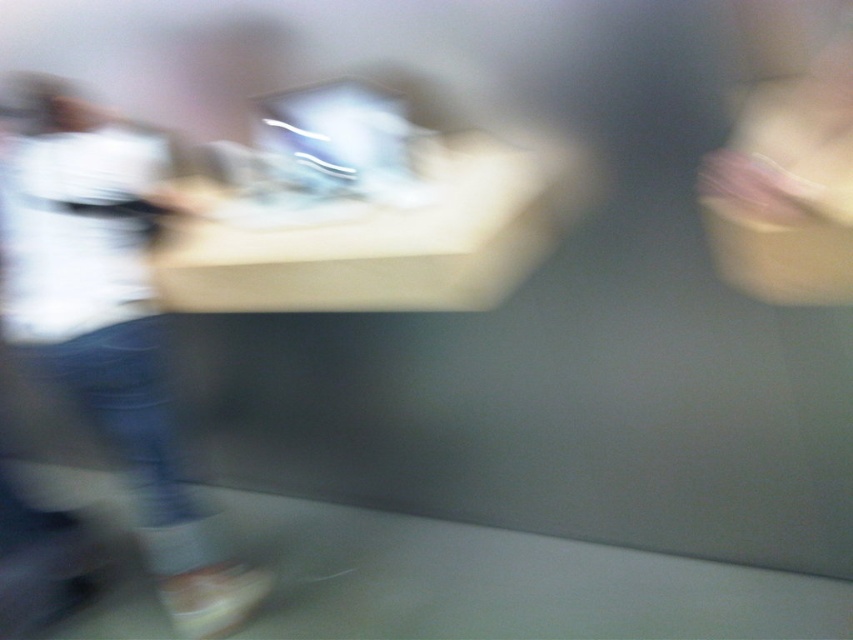
Based on the scene description, where is the blue jeans located in relation to the point marked at coordinates (109, 326)?

The blue jeans at left are located at the coordinates marked by point (109, 326).

Consider the image. Based on the provided scene description, where is the blue jeans at left located in terms of its 2D coordinates?

The blue jeans at left is located at the 2D coordinates of point (109, 326).

You are a photographer trying to capture a clear image of the matte plastic computer at center and the blue jeans at left. Based on the scene description, which object is closer to you, the photographer, and might be causing the blur in the image?

The blue jeans at left is further to the viewer than matte plastic computer at center, so the blue jeans at left is closer to you and might be causing the blur in the image.